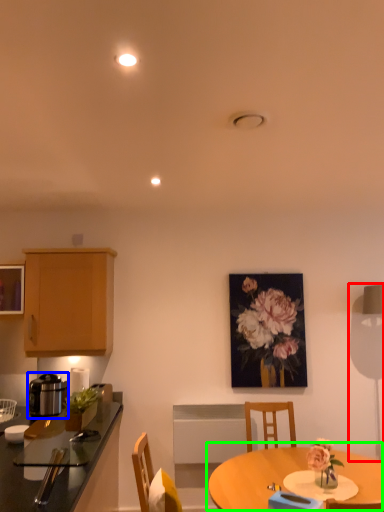
Question: Based on their relative distances, which object is nearer to table lamp (highlighted by a red box)? Choose from kitchen appliance (highlighted by a blue box) and table (highlighted by a green box).

Choices:
 (A) kitchen appliance
 (B) table

Answer: (B)